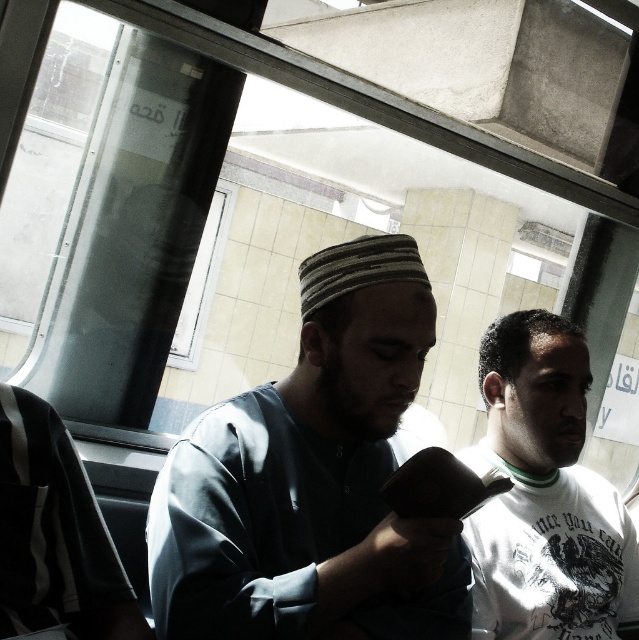
Which is more to the right, white matte shirt at center or striped fabric shirt at left?

white matte shirt at center is more to the right.

Which is behind, point (530, 333) or point (35, 547)?

The point (530, 333) is more distant.

Who is more forward, (606, 534) or (81, 554)?

Point (81, 554)

The width and height of the screenshot is (639, 640). I want to click on white matte shirt at center, so click(544, 493).

Is light blue fabric shirt at center taller than white matte shirt at center?

No, light blue fabric shirt at center is not taller than white matte shirt at center.

Identify the location of light blue fabric shirt at center. (312, 480).

Find the location of a particular element. light blue fabric shirt at center is located at coordinates (312, 480).

Can you confirm if light blue fabric shirt at center is positioned to the right of striped fabric shirt at left?

Indeed, light blue fabric shirt at center is positioned on the right side of striped fabric shirt at left.

Measure the distance between point (194, 621) and camera.

Point (194, 621) is 37.77 inches away from camera.

At what (x,y) coordinates should I click in order to perform the action: click on light blue fabric shirt at center. Please return your answer as a coordinate pair (x, y). Looking at the image, I should click on coord(312,480).

You are a GUI agent. You are given a task and a screenshot of the screen. Output one action in this format:
    pyautogui.click(x=<x>, y=<y>)
    Task: Click on the light blue fabric shirt at center
    
    Given the screenshot: What is the action you would take?
    pyautogui.click(x=312, y=480)